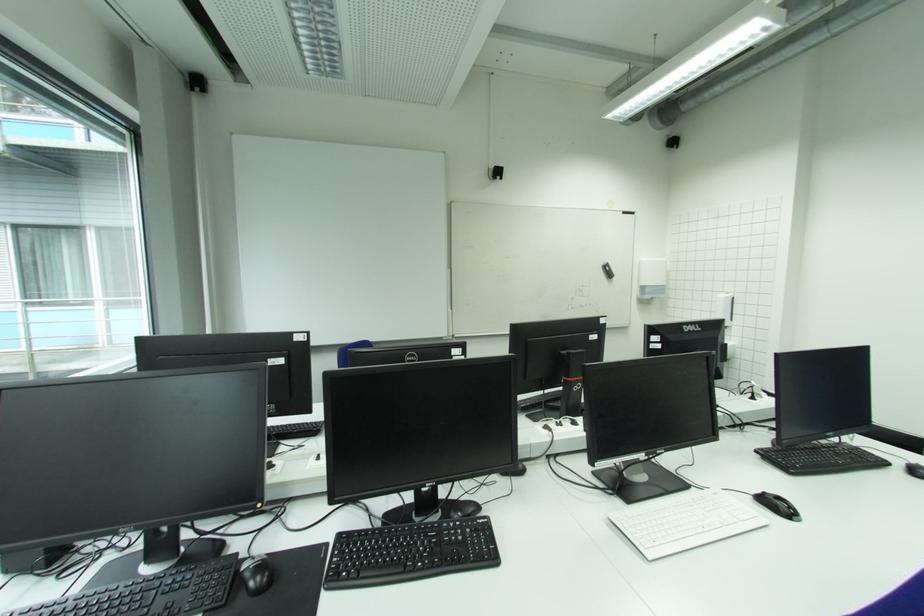
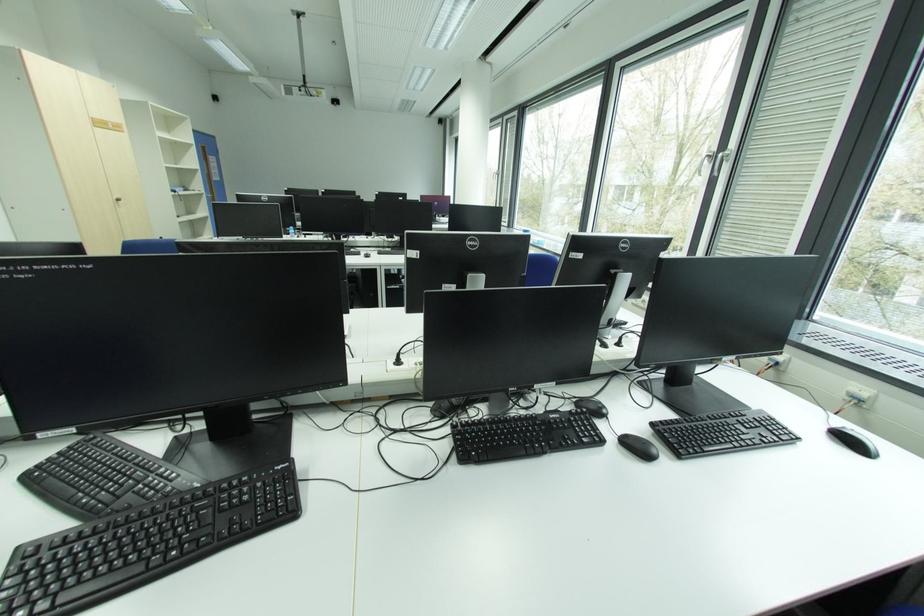
Question: I am providing you with two images of the same scene from different viewpoints. Which of the following objects are not visible in image2?

Choices:
 (A) clear water bottle
 (B) black keyboard
 (C) silver window handle
 (D) machine control dial

Answer: (B)